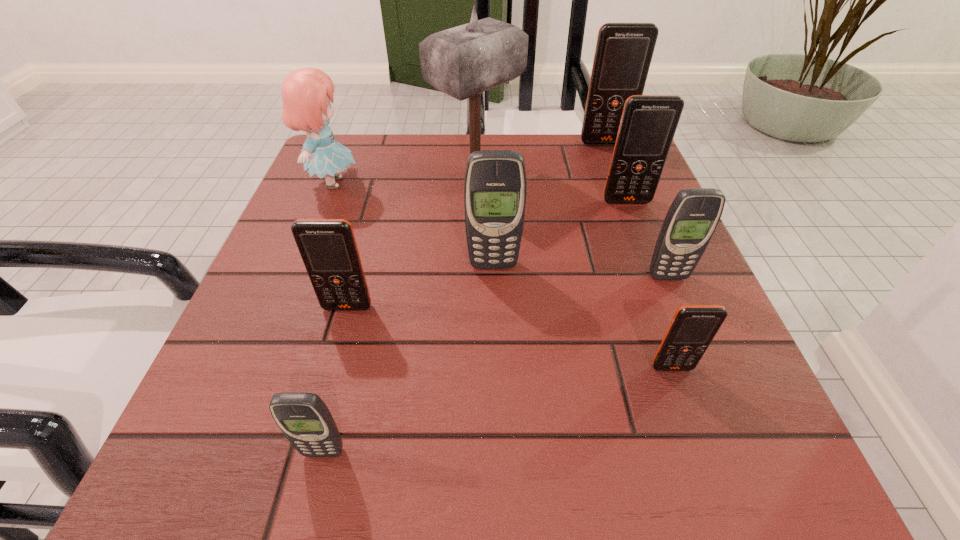
You are a GUI agent. You are given a task and a screenshot of the screen. Output one action in this format:
    pyautogui.click(x=<x>, y=<y>)
    Task: Click on the cellular telephone that is the sixth closest to the biggest gray cellular telephone
    This screenshot has width=960, height=540.
    Given the screenshot: What is the action you would take?
    pyautogui.click(x=623, y=54)

Locate which cellular telephone ranks in proximity to the fourth farthest cellular telephone. Please provide its 2D coordinates. Your answer should be formatted as a tuple, i.e. [(x, y)], where the tuple contains the x and y coordinates of a point satisfying the conditions above.

[(693, 327)]

Choose which orange cellular telephone is the fourth nearest neighbor to the blue doll. Please provide its 2D coordinates. Your answer should be formatted as a tuple, i.e. [(x, y)], where the tuple contains the x and y coordinates of a point satisfying the conditions above.

[(693, 327)]

Locate which orange cellular telephone ranks in proximity to the fourth nearest object. Please provide its 2D coordinates. Your answer should be formatted as a tuple, i.e. [(x, y)], where the tuple contains the x and y coordinates of a point satisfying the conditions above.

[(693, 327)]

Locate an element on the screen. The width and height of the screenshot is (960, 540). the second closest gray cellular telephone to the leftmost object is located at coordinates (305, 420).

Point out which gray cellular telephone is positioned as the nearest to the rightmost gray cellular telephone. Please provide its 2D coordinates. Your answer should be formatted as a tuple, i.e. [(x, y)], where the tuple contains the x and y coordinates of a point satisfying the conditions above.

[(495, 188)]